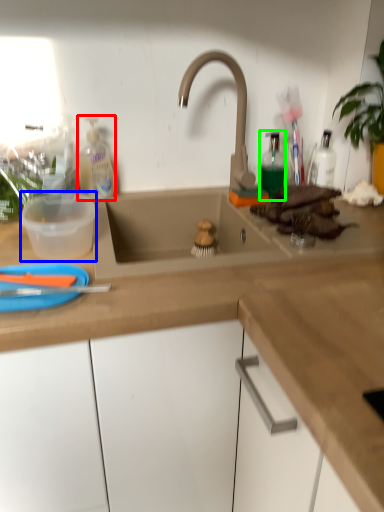
Question: Which object is positioned closest to cleaning product (highlighted by a red box)? Select from basin (highlighted by a blue box) and bottle (highlighted by a green box).

Choices:
 (A) basin
 (B) bottle

Answer: (A)